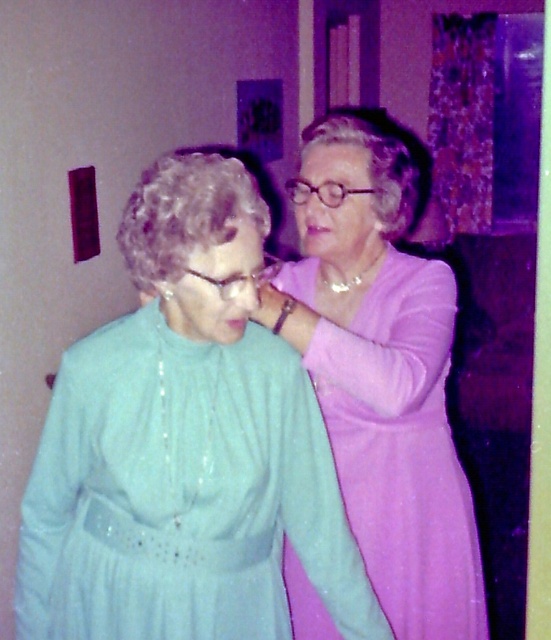
Question: Which point is farther to the camera?

Choices:
 (A) matte purple dress at upper right
 (B) matte pink forehead at upper center
 (C) matte green dress at center

Answer: (B)

Question: Does matte green dress at center appear on the left side of matte pink forehead at upper center?

Choices:
 (A) yes
 (B) no

Answer: (A)

Question: Can you confirm if matte green dress at center is bigger than matte purple dress at upper right?

Choices:
 (A) yes
 (B) no

Answer: (B)

Question: Which is nearer to the matte purple dress at upper right?

Choices:
 (A) matte green dress at center
 (B) matte pink forehead at upper center

Answer: (A)

Question: Does matte purple dress at upper right have a smaller size compared to matte pink forehead at upper center?

Choices:
 (A) no
 (B) yes

Answer: (A)

Question: Which point appears farthest from the camera in this image?

Choices:
 (A) (445, 285)
 (B) (328, 154)
 (C) (109, 353)

Answer: (B)